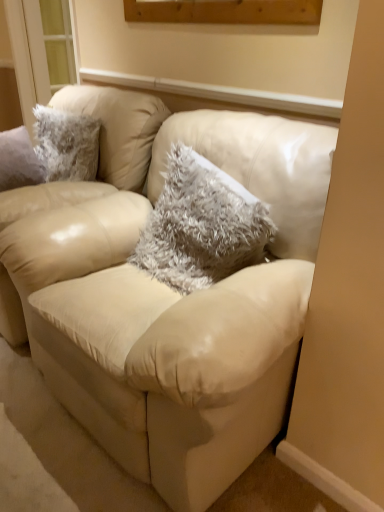
Find the location of a particular element. beige leather chair at center is located at coordinates (79, 205).

At what (x,y) coordinates should I click in order to perform the action: click on fuzzy gray pillow at center. Please return your answer as a coordinate pair (x, y). Looking at the image, I should click on (201, 225).

The image size is (384, 512). Find the location of `throw pillow lying on the right of transparent glass window at upper left`. throw pillow lying on the right of transparent glass window at upper left is located at coordinates (201, 225).

From a real-world perspective, who is located higher, transparent glass window at upper left or fuzzy gray pillow at center?

From a 3D spatial view, transparent glass window at upper left is above.

Which is correct: transparent glass window at upper left is inside fuzzy gray pillow at center, or outside of it?

transparent glass window at upper left cannot be found inside fuzzy gray pillow at center.

Which is farther, (148, 125) or (185, 270)?

The point (148, 125) is more distant.

Is beige leather chair at center turned away from fuzzy gray pillow at center?

beige leather chair at center is not turned away from fuzzy gray pillow at center.

This screenshot has width=384, height=512. In the image, there is a fuzzy gray pillow at center. Identify the location of chair below it (from a real-world perspective). (79, 205).

From a real-world perspective, who is located lower, beige leather chair at center or fuzzy gray pillow at center?

beige leather chair at center, from a real-world perspective.

Is beige leather couch at center next to fuzzy gray pillow at center and touching it?

beige leather couch at center and fuzzy gray pillow at center are not in contact.

Is beige leather couch at center oriented away from fuzzy gray pillow at center?

Absolutely, beige leather couch at center is directed away from fuzzy gray pillow at center.

Based on the photo, from the image's perspective, is beige leather couch at center located above fuzzy gray pillow at center?

Incorrect, from the image's perspective, beige leather couch at center is lower than fuzzy gray pillow at center.

Is transparent glass window at upper left at the left side of beige leather chair at center?

Yes.

Is there a large distance between transparent glass window at upper left and beige leather chair at center?

Yes, transparent glass window at upper left and beige leather chair at center are quite far apart.

Which is correct: transparent glass window at upper left is inside beige leather chair at center, or outside of it?

The correct answer is: outside.

From a real-world perspective, is transparent glass window at upper left located beneath beige leather chair at center?

No.

Is beige leather couch at center completely or partially inside transparent glass window at upper left?

No.

Is point (14, 54) closer to camera compared to point (205, 503)?

No, (14, 54) is further to viewer.

Considering the positions of objects transparent glass window at upper left and beige leather couch at center in the image provided, who is more to the left, transparent glass window at upper left or beige leather couch at center?

transparent glass window at upper left.

From a real-world perspective, relative to beige leather couch at center, is transparent glass window at upper left vertically above or below?

Clearly, from a real-world perspective, transparent glass window at upper left is above beige leather couch at center.

Would you say beige leather couch at center is a long distance from beige leather chair at center?

No, beige leather couch at center is in close proximity to beige leather chair at center.

From the image's perspective, is beige leather couch at center located above or below beige leather chair at center?

From the image's perspective, beige leather couch at center appears below beige leather chair at center.

From a real-world perspective, is beige leather couch at center physically below beige leather chair at center?

Correct, in the physical world, beige leather couch at center is lower than beige leather chair at center.

Measure the distance from beige leather couch at center to beige leather chair at center.

beige leather couch at center is 12.62 inches from beige leather chair at center.

Considering the relative sizes of beige leather chair at center and beige leather couch at center in the image provided, is beige leather chair at center shorter than beige leather couch at center?

Indeed, beige leather chair at center has a lesser height compared to beige leather couch at center.

Between beige leather chair at center and beige leather couch at center, which one has smaller width?

beige leather couch at center is thinner.

Is beige leather chair at center not within beige leather couch at center?

beige leather chair at center lies outside beige leather couch at center's area.

From a real-world perspective, is beige leather chair at center located beneath beige leather couch at center?

Incorrect, from a real-world perspective, beige leather chair at center is higher than beige leather couch at center.

This screenshot has width=384, height=512. In order to click on window located on the left of fuzzy gray pillow at center in this screenshot , I will do pyautogui.click(x=28, y=55).

Locate an element on the screen. The image size is (384, 512). throw pillow in front of the beige leather chair at center is located at coordinates (201, 225).

Looking at the image, which one is located further to beige leather chair at center, transparent glass window at upper left or fuzzy gray pillow at center?

transparent glass window at upper left.

From the image, which object appears to be nearer to beige leather couch at center, transparent glass window at upper left or fuzzy gray pillow at center?

fuzzy gray pillow at center.

Looking at the image, which one is located closer to beige leather chair at center, transparent glass window at upper left or beige leather couch at center?

beige leather couch at center.

Looking at the image, which one is located further to beige leather chair at center, beige leather couch at center or fuzzy gray pillow at center?

The object further to beige leather chair at center is fuzzy gray pillow at center.

Based on their spatial positions, is beige leather chair at center or transparent glass window at upper left closer to beige leather couch at center?

beige leather chair at center.

Estimate the real-world distances between objects in this image. Which object is closer to fuzzy gray pillow at center, beige leather chair at center or transparent glass window at upper left?

The object closer to fuzzy gray pillow at center is beige leather chair at center.

From the image, which object appears to be farther from transparent glass window at upper left, fuzzy gray pillow at center or beige leather couch at center?

Based on the image, beige leather couch at center appears to be further to transparent glass window at upper left.

Which object lies further to the anchor point fuzzy gray pillow at center, transparent glass window at upper left or beige leather chair at center?

transparent glass window at upper left lies further to fuzzy gray pillow at center than the other object.

I want to click on chair positioned between beige leather couch at center and transparent glass window at upper left from near to far, so click(x=79, y=205).

This screenshot has height=512, width=384. In order to click on throw pillow between beige leather couch at center and transparent glass window at upper left from front to back in this screenshot , I will do `click(201, 225)`.

Where is `studio couch between beige leather chair at center and fuzzy gray pillow at center in the horizontal direction`? studio couch between beige leather chair at center and fuzzy gray pillow at center in the horizontal direction is located at coordinates (142, 339).

Where is `chair located between fuzzy gray pillow at center and transparent glass window at upper left in the depth direction`? The image size is (384, 512). chair located between fuzzy gray pillow at center and transparent glass window at upper left in the depth direction is located at coordinates (79, 205).